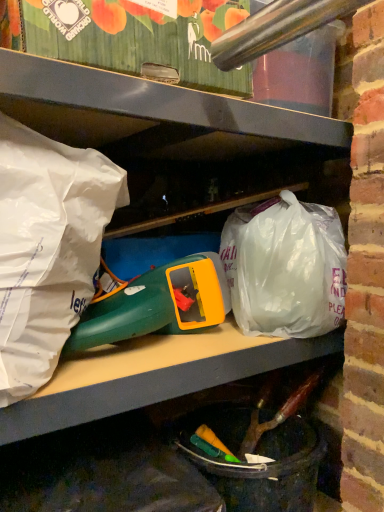
How much space does translucent plastic bag at center, acting as the 2th plastic bag starting from the front, occupy horizontally?

translucent plastic bag at center, acting as the 2th plastic bag starting from the front, is 33.54 centimeters wide.

Measure the distance between point (67,332) and camera.

Point (67,332) is 62.30 centimeters away from camera.

Locate an element on the screen. Image resolution: width=384 pixels, height=512 pixels. green plastic toy at center is located at coordinates (157, 304).

Locate an element on the screen. translucent plastic bag at center, the 1th plastic bag viewed from the right is located at coordinates (285, 267).

Where is `plastic bag to the right of green plastic toy at center`? plastic bag to the right of green plastic toy at center is located at coordinates (285, 267).

From a real-world perspective, between translucent plastic bag at center, the 1th plastic bag viewed from the right, and green plastic toy at center, who is vertically higher?

translucent plastic bag at center, the 1th plastic bag viewed from the right, is physically above.

Can green plastic toy at center be found inside translucent plastic bag at center, which is the second plastic bag from left to right?

That's incorrect, green plastic toy at center is not inside translucent plastic bag at center, which is the second plastic bag from left to right.

How distant is translucent plastic bag at center, which is the 1th plastic bag from back to front, from green plastic toy at center?

translucent plastic bag at center, which is the 1th plastic bag from back to front, is 5.99 inches away from green plastic toy at center.

From a real-world perspective, is translucent plastic bag at center, the 1th plastic bag viewed from the right, above or below white paper bag at left, placed as the 1th plastic bag when sorted from left to right?

translucent plastic bag at center, the 1th plastic bag viewed from the right, is below white paper bag at left, placed as the 1th plastic bag when sorted from left to right.

Considering the sizes of translucent plastic bag at center, the 1th plastic bag viewed from the right, and white paper bag at left, which is the 1th plastic bag from front to back, in the image, is translucent plastic bag at center, the 1th plastic bag viewed from the right, wider or thinner than white paper bag at left, which is the 1th plastic bag from front to back,?

translucent plastic bag at center, the 1th plastic bag viewed from the right, is wider than white paper bag at left, which is the 1th plastic bag from front to back.

Which of these two, translucent plastic bag at center, the 1th plastic bag viewed from the right, or white paper bag at left, which is the 1th plastic bag from front to back, is bigger?

Bigger between the two is translucent plastic bag at center, the 1th plastic bag viewed from the right.

Is green plastic toy at center to the right of translucent plastic bag at center, which is the second plastic bag from left to right, from the viewer's perspective?

No, green plastic toy at center is not to the right of translucent plastic bag at center, which is the second plastic bag from left to right.

Is point (204, 318) closer to camera compared to point (256, 219)?

Yes, point (204, 318) is closer to viewer.

Is translucent plastic bag at center, acting as the 2th plastic bag starting from the front, at the back of green plastic toy at center?

No, green plastic toy at center is not facing the opposite direction of translucent plastic bag at center, acting as the 2th plastic bag starting from the front.

Is green plastic toy at center smaller than translucent plastic bag at center, which is the second plastic bag from left to right?

Indeed, green plastic toy at center has a smaller size compared to translucent plastic bag at center, which is the second plastic bag from left to right.

From their relative heights in the image, would you say white paper bag at left, which is the 1th plastic bag from front to back, is taller or shorter than translucent plastic bag at center, which is the 1th plastic bag from back to front?

Clearly, white paper bag at left, which is the 1th plastic bag from front to back, is taller compared to translucent plastic bag at center, which is the 1th plastic bag from back to front.

Measure the distance from white paper bag at left, which is the second plastic bag in back-to-front order, to translucent plastic bag at center, the 1th plastic bag viewed from the right.

white paper bag at left, which is the second plastic bag in back-to-front order, is 14.97 inches away from translucent plastic bag at center, the 1th plastic bag viewed from the right.

Is white paper bag at left, which is the 1th plastic bag from front to back, with translucent plastic bag at center, which is the 1th plastic bag from back to front?

white paper bag at left, which is the 1th plastic bag from front to back, and translucent plastic bag at center, which is the 1th plastic bag from back to front, are clearly separated.

Looking at this image, is white paper bag at left, which is the second plastic bag in back-to-front order, taller than green plastic toy at center?

Yes, white paper bag at left, which is the second plastic bag in back-to-front order, is taller than green plastic toy at center.

Is green plastic toy at center at the back of white paper bag at left, which is the 1th plastic bag from front to back?

No, white paper bag at left, which is the 1th plastic bag from front to back, is not facing the opposite direction of green plastic toy at center.

Considering the relative sizes of white paper bag at left, the second plastic bag positioned from the right, and green plastic toy at center in the image provided, is white paper bag at left, the second plastic bag positioned from the right, thinner than green plastic toy at center?

No, white paper bag at left, the second plastic bag positioned from the right, is not thinner than green plastic toy at center.

Can you tell me how much green plastic toy at center and white paper bag at left, which is the second plastic bag in back-to-front order, differ in facing direction?

The angle between the facing direction of green plastic toy at center and the facing direction of white paper bag at left, which is the second plastic bag in back-to-front order, is 1.74 degrees.

From a real-world perspective, is green plastic toy at center on white paper bag at left, the second plastic bag positioned from the right?

No, from a real-world perspective, green plastic toy at center is not on top of white paper bag at left, the second plastic bag positioned from the right.

Is green plastic toy at center directly adjacent to white paper bag at left, which is the second plastic bag in back-to-front order?

green plastic toy at center and white paper bag at left, which is the second plastic bag in back-to-front order, are not in contact.

Image resolution: width=384 pixels, height=512 pixels. Identify the location of the 1st plastic bag directly above the green plastic toy at center (from a real-world perspective). (285, 267).

Locate an element on the screen. The image size is (384, 512). plastic bag behind the white paper bag at left, which is the 1th plastic bag from front to back is located at coordinates (285, 267).

From the image, which object appears to be nearer to translucent plastic bag at center, the 1th plastic bag viewed from the right, green plastic toy at center or white paper bag at left, the second plastic bag positioned from the right?

Among the two, green plastic toy at center is located nearer to translucent plastic bag at center, the 1th plastic bag viewed from the right.

From the picture: Based on their spatial positions, is green plastic toy at center or translucent plastic bag at center, which is the 1th plastic bag from back to front, further from white paper bag at left, which is the 1th plastic bag from front to back?

Among the two, translucent plastic bag at center, which is the 1th plastic bag from back to front, is located further to white paper bag at left, which is the 1th plastic bag from front to back.

From the image, which object appears to be nearer to white paper bag at left, which is the second plastic bag in back-to-front order, translucent plastic bag at center, the 1th plastic bag viewed from the right, or green plastic toy at center?

green plastic toy at center is closer to white paper bag at left, which is the second plastic bag in back-to-front order.

Estimate the real-world distances between objects in this image. Which object is further from green plastic toy at center, translucent plastic bag at center, which is the 1th plastic bag from back to front, or white paper bag at left, placed as the 1th plastic bag when sorted from left to right?

Among the two, white paper bag at left, placed as the 1th plastic bag when sorted from left to right, is located further to green plastic toy at center.

When comparing their distances from green plastic toy at center, does white paper bag at left, the second plastic bag positioned from the right, or translucent plastic bag at center, the 1th plastic bag viewed from the right, seem further?

The object further to green plastic toy at center is white paper bag at left, the second plastic bag positioned from the right.

From the image, which object appears to be nearer to translucent plastic bag at center, which is the second plastic bag from left to right, white paper bag at left, which is the 1th plastic bag from front to back, or green plastic toy at center?

Among the two, green plastic toy at center is located nearer to translucent plastic bag at center, which is the second plastic bag from left to right.

You are a GUI agent. You are given a task and a screenshot of the screen. Output one action in this format:
    pyautogui.click(x=<x>, y=<y>)
    Task: Click on the toy between white paper bag at left, which is the second plastic bag in back-to-front order, and translucent plastic bag at center, which is the 1th plastic bag from back to front, from left to right
    The height and width of the screenshot is (512, 384).
    Given the screenshot: What is the action you would take?
    pyautogui.click(x=157, y=304)